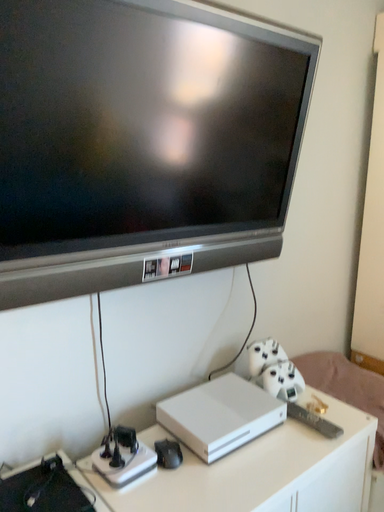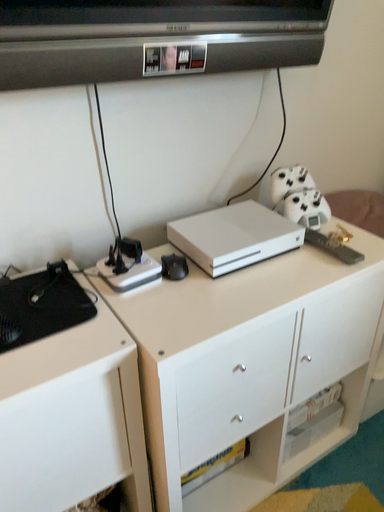
Question: How did the camera likely rotate when shooting the video?

Choices:
 (A) rotated right
 (B) rotated left

Answer: (B)